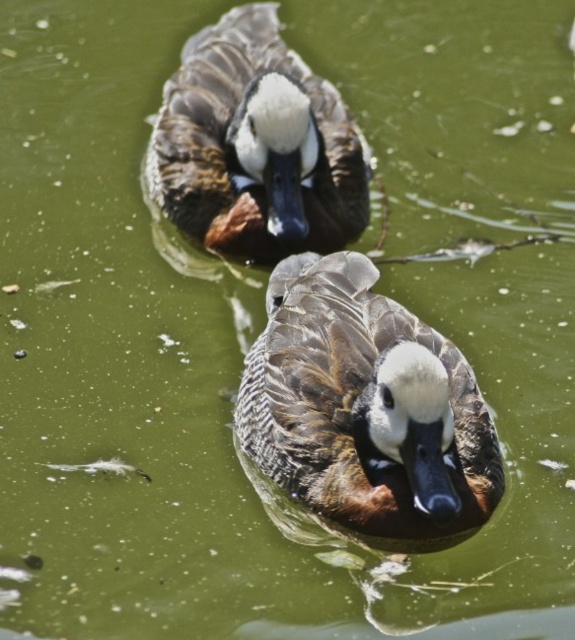
Which is more to the right, brown speckled duck at center or brown speckled duck at upper center?

brown speckled duck at center

Based on the photo, does brown speckled duck at center have a smaller size compared to brown speckled duck at upper center?

Yes, brown speckled duck at center is smaller than brown speckled duck at upper center.

Is point (315, 484) more distant than point (277, 26)?

No, (315, 484) is in front of (277, 26).

Find the location of a particular element. Image resolution: width=575 pixels, height=640 pixels. brown speckled duck at center is located at coordinates (366, 406).